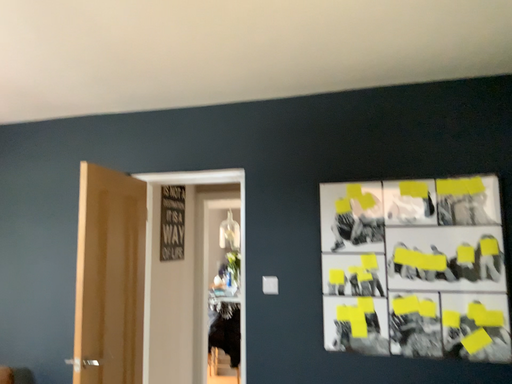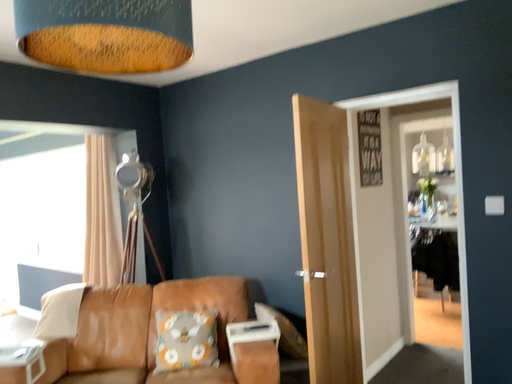
Question: Which way did the camera rotate in the video?

Choices:
 (A) rotated downward
 (B) rotated upward

Answer: (A)